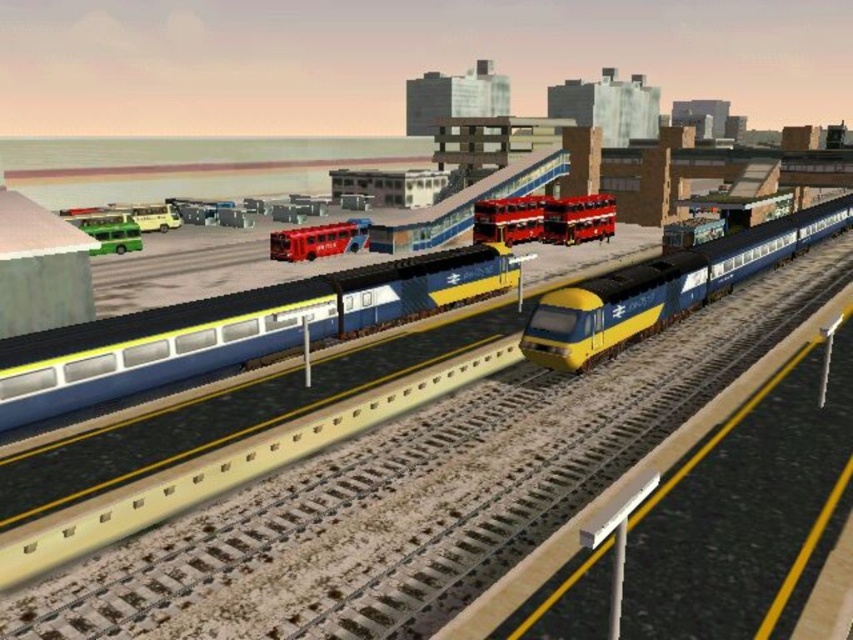
You are a passenger trying to board a vehicle. You see both the blue glossy train at center and the metallic red bus at center. Which one is bigger in size?

The blue glossy train at center is larger in size compared to the metallic red bus at center.

You are a pedestrian standing at the edge of the train station platform. You see the blue glossy train at center and the metallic red bus at center. Which one would block your view more if you were to stand directly in front of them?

The blue glossy train at center is wider than the metallic red bus at center, so it would block your view more if you were to stand directly in front of them.

You are a passenger standing at the train station and see the red metallic bus at center and the metallic red bus at center. Which one is positioned higher in the scene?

The red metallic bus at center is positioned higher than the metallic red bus at center in the scene.